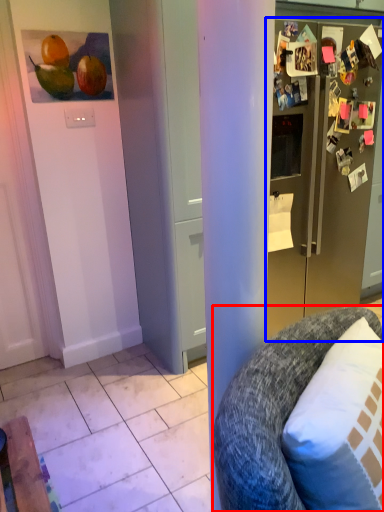
Question: Which object is closer to the camera taking this photo, chair (highlighted by a red box) or refrigerator (highlighted by a blue box)?

Choices:
 (A) chair
 (B) refrigerator

Answer: (A)